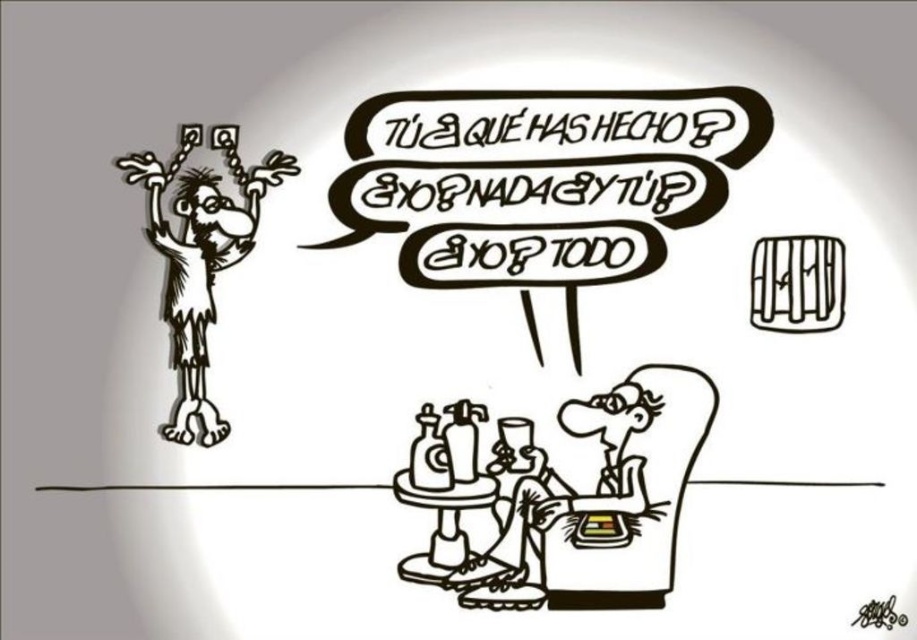
What do you see at coordinates (628, 490) in the screenshot? This screenshot has width=917, height=640. I see `white fabric armchair at lower right` at bounding box center [628, 490].

Is white fabric armchair at lower right to the left of smooth wood stool at lower center from the viewer's perspective?

Incorrect, white fabric armchair at lower right is not on the left side of smooth wood stool at lower center.

Is point (569, 605) farther from camera compared to point (410, 474)?

No.

Locate an element on the screen. The height and width of the screenshot is (640, 917). white fabric armchair at lower right is located at coordinates click(x=628, y=490).

The height and width of the screenshot is (640, 917). What do you see at coordinates (199, 259) in the screenshot? I see `black ink drawing of man at left` at bounding box center [199, 259].

Which is more to the left, black ink drawing of man at left or smooth wood stool at lower center?

From the viewer's perspective, black ink drawing of man at left appears more on the left side.

Where is `black ink drawing of man at left`? This screenshot has height=640, width=917. black ink drawing of man at left is located at coordinates (199, 259).

This screenshot has height=640, width=917. What do you see at coordinates (572, 492) in the screenshot?
I see `smooth skin man at lower center` at bounding box center [572, 492].

Is smooth skin man at lower center below smooth wood stool at lower center?

Actually, smooth skin man at lower center is above smooth wood stool at lower center.

Measure the distance between smooth skin man at lower center and camera.

smooth skin man at lower center is 3.74 feet away from camera.

This screenshot has height=640, width=917. I want to click on smooth skin man at lower center, so click(572, 492).